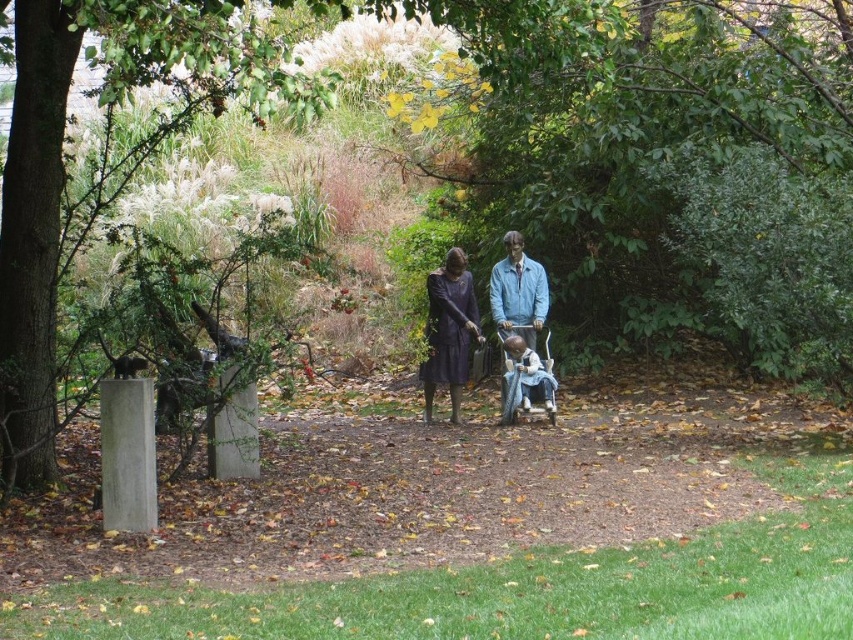
Question: Which object is farther from the camera taking this photo?

Choices:
 (A) matte purple dress at center
 (B) wooden baby carriage at center
 (C) green leafy tree at center

Answer: (A)

Question: Is smooth gray post at left positioned at the back of matte purple dress at center?

Choices:
 (A) no
 (B) yes

Answer: (A)

Question: Which object is farther from the camera taking this photo?

Choices:
 (A) wooden baby carriage at center
 (B) matte black dress at center
 (C) smooth gray post at left
 (D) green leafy tree at center

Answer: (B)

Question: Does green leafy tree at center have a greater width compared to smooth gray post at left?

Choices:
 (A) yes
 (B) no

Answer: (A)

Question: Based on their relative distances, which object is farther from the wooden baby carriage at center?

Choices:
 (A) matte purple dress at center
 (B) smooth gray post at left

Answer: (B)

Question: Does matte black dress at center appear on the right side of matte purple dress at center?

Choices:
 (A) yes
 (B) no

Answer: (A)